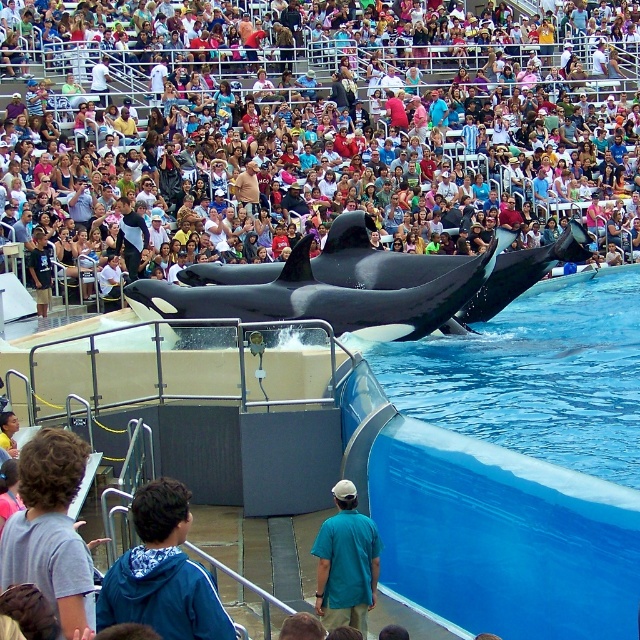
From the picture: Who is taller, blue smooth water at upper right or black smooth orca at center?

Standing taller between the two is blue smooth water at upper right.

Who is shorter, blue smooth water at upper right or black smooth orca at center?

Standing shorter between the two is black smooth orca at center.

Which is behind, point (620, 417) or point (230, 317)?

Point (230, 317)

This screenshot has width=640, height=640. Find the location of `blue smooth water at upper right`. blue smooth water at upper right is located at coordinates pos(536,376).

Is black smooth orca at center shorter than blue fleece jacket at lower left?

In fact, black smooth orca at center may be taller than blue fleece jacket at lower left.

Measure the distance between point (x=209, y=308) and camera.

The distance of point (x=209, y=308) from camera is 67.06 meters.

Is point (490, 288) positioned in front of point (168, 497)?

No, (490, 288) is behind (168, 497).

This screenshot has height=640, width=640. Find the location of `black smooth orca at center`. black smooth orca at center is located at coordinates (364, 285).

Which is more to the right, gray cotton shirt at lower left or teal shirt at center?

teal shirt at center

Who is lower down, gray cotton shirt at lower left or teal shirt at center?

Positioned lower is teal shirt at center.

Identify the location of gray cotton shirt at lower left. (51, 529).